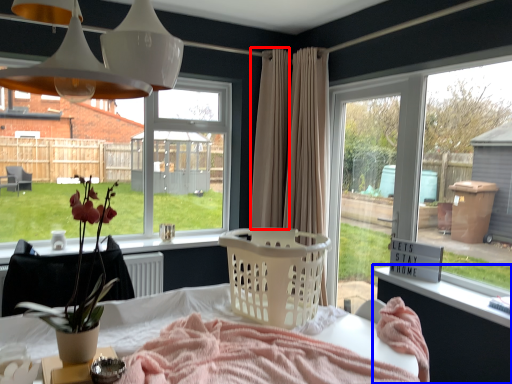
Question: Which of the following is the farthest to the observer, curtain (highlighted by a red box) or changing table (highlighted by a blue box)?

Choices:
 (A) curtain
 (B) changing table

Answer: (A)